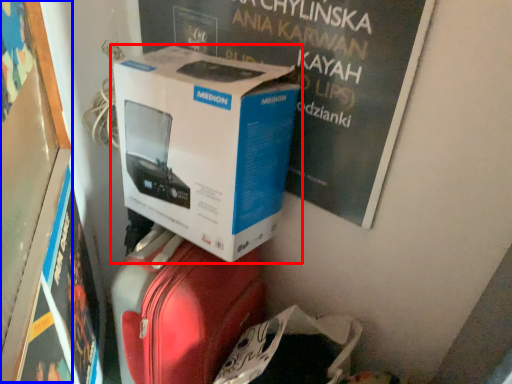
Question: Among these objects, which one is farthest to the camera, box (highlighted by a red box) or bulletin board (highlighted by a blue box)?

Choices:
 (A) box
 (B) bulletin board

Answer: (A)